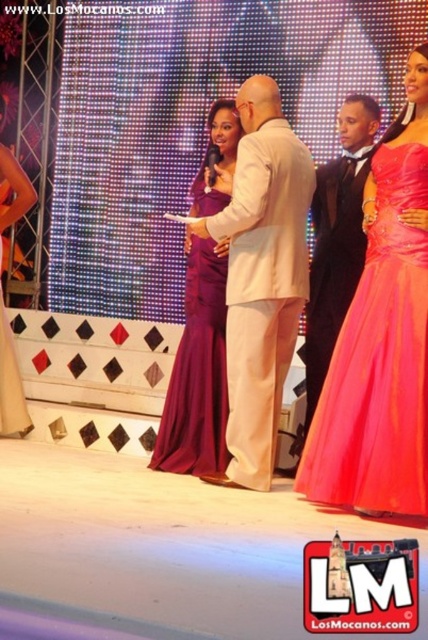
Can you confirm if burgundy satin dress at center is thinner than matte purple dress at lower left?

Incorrect, burgundy satin dress at center's width is not less than matte purple dress at lower left's.

Between burgundy satin dress at center and matte purple dress at lower left, which one appears on the right side from the viewer's perspective?

burgundy satin dress at center

Is point (190, 314) more distant than point (2, 371)?

That is False.

The image size is (428, 640). In order to click on burgundy satin dress at center in this screenshot , I will do `click(198, 372)`.

Between purple satin dress at center and matte purple dress at lower left, which one appears on the right side from the viewer's perspective?

purple satin dress at center

Can you confirm if purple satin dress at center is shorter than matte purple dress at lower left?

In fact, purple satin dress at center may be taller than matte purple dress at lower left.

Which is behind, point (407, 401) or point (5, 372)?

Positioned behind is point (5, 372).

I want to click on purple satin dress at center, so click(382, 339).

Between purple satin dress at center and burgundy satin dress at center, which one is positioned higher?

purple satin dress at center is above.

You are a GUI agent. You are given a task and a screenshot of the screen. Output one action in this format:
    pyautogui.click(x=<x>, y=<y>)
    Task: Click on the purple satin dress at center
    This screenshot has width=428, height=640.
    Given the screenshot: What is the action you would take?
    pyautogui.click(x=382, y=339)

Does point (395, 228) come in front of point (204, 429)?

Yes, it is.

This screenshot has width=428, height=640. I want to click on purple satin dress at center, so click(x=382, y=339).